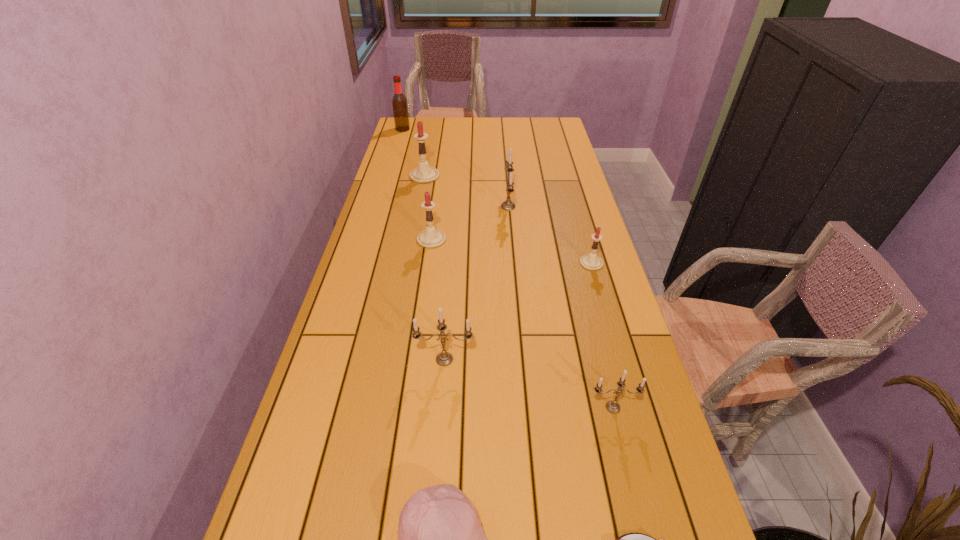
Find the location of a particular element. This screenshot has width=960, height=540. the farthest object is located at coordinates (399, 102).

I want to click on beer bottle, so click(x=399, y=102).

Where is `the second metallic candle from left to right`? The image size is (960, 540). the second metallic candle from left to right is located at coordinates point(508,204).

The width and height of the screenshot is (960, 540). I want to click on the seventh nearest object, so click(508, 204).

I want to click on the second farthest object, so click(423, 174).

You are a GUI agent. You are given a task and a screenshot of the screen. Output one action in this format:
    pyautogui.click(x=<x>, y=<y>)
    Task: Click on the farthest candle
    This screenshot has height=540, width=960.
    Given the screenshot: What is the action you would take?
    (x=423, y=174)

Find the location of a particular element. the fourth farthest object is located at coordinates (430, 238).

Locate an element on the screen. the fourth nearest candle is located at coordinates (430, 238).

In order to click on the leftmost metallic candle in this screenshot , I will do `click(444, 358)`.

You are a GUI agent. You are given a task and a screenshot of the screen. Output one action in this format:
    pyautogui.click(x=<x>, y=<y>)
    Task: Click on the second nearest candle
    
    Given the screenshot: What is the action you would take?
    pyautogui.click(x=444, y=358)